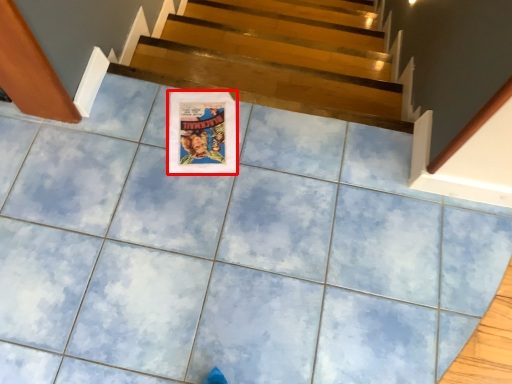
Question: From the image's perspective, where is poster page (annotated by the red box) located in relation to stairs in the image?

Choices:
 (A) below
 (B) above

Answer: (A)